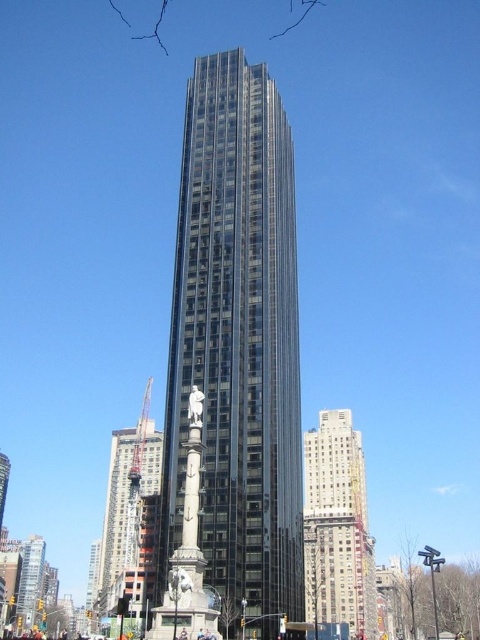
Is point (170, 445) farther from viewer compared to point (153, 554)?

No, (170, 445) is in front of (153, 554).

Between point (192, 211) and point (117, 484), which one is positioned in front?

Point (192, 211)

Locate an element on the screen. This screenshot has height=640, width=480. shiny glass tower at center is located at coordinates (238, 346).

Is brick textured building at center bigger than metallic glass construction at center?

No.

Is brick textured building at center thinner than metallic glass construction at center?

Indeed, brick textured building at center has a lesser width compared to metallic glass construction at center.

The width and height of the screenshot is (480, 640). In order to click on brick textured building at center in this screenshot , I will do `click(337, 528)`.

Who is more forward, (239, 476) or (314, 506)?

Point (239, 476) is more forward.

Between point (285, 301) and point (372, 554), which one is positioned behind?

Positioned behind is point (372, 554).

Describe the element at coordinates (238, 346) in the screenshot. I see `shiny glass tower at center` at that location.

Locate an element on the screen. The image size is (480, 640). shiny glass tower at center is located at coordinates (238, 346).